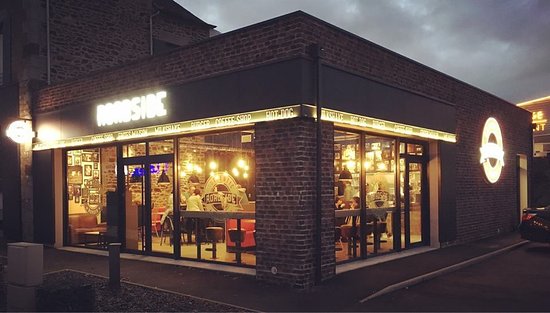
You are a GUI agent. You are given a task and a screenshot of the screen. Output one action in this format:
    pyautogui.click(x=<x>, y=<y>)
    Task: Click on the table
    The width and height of the screenshot is (550, 313).
    Given the screenshot: What is the action you would take?
    pos(211,211), pos(378,208)